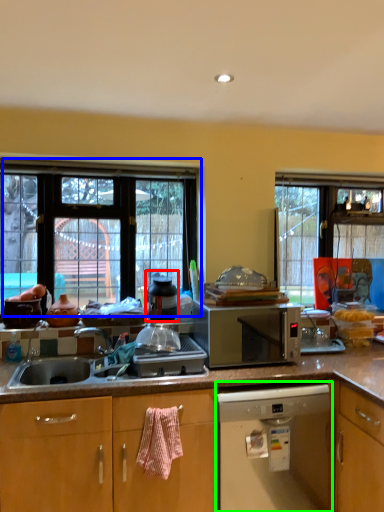
Question: Considering the real-world distances, which object is farthest from appliance (highlighted by a red box)? window (highlighted by a blue box) or home appliance (highlighted by a green box)?

Choices:
 (A) window
 (B) home appliance

Answer: (B)